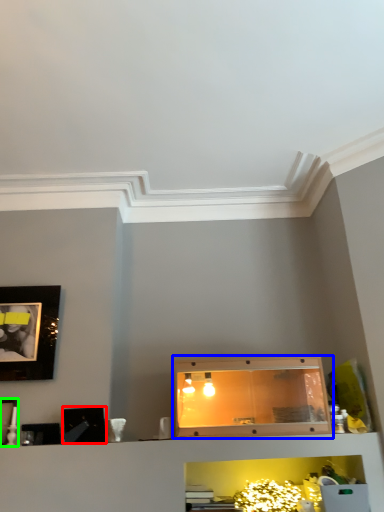
Question: Based on their relative distances, which object is nearer to picture frame (highlighted by a red box)? Choose from cabinetry (highlighted by a blue box) and picture frame (highlighted by a green box).

Choices:
 (A) cabinetry
 (B) picture frame

Answer: (B)